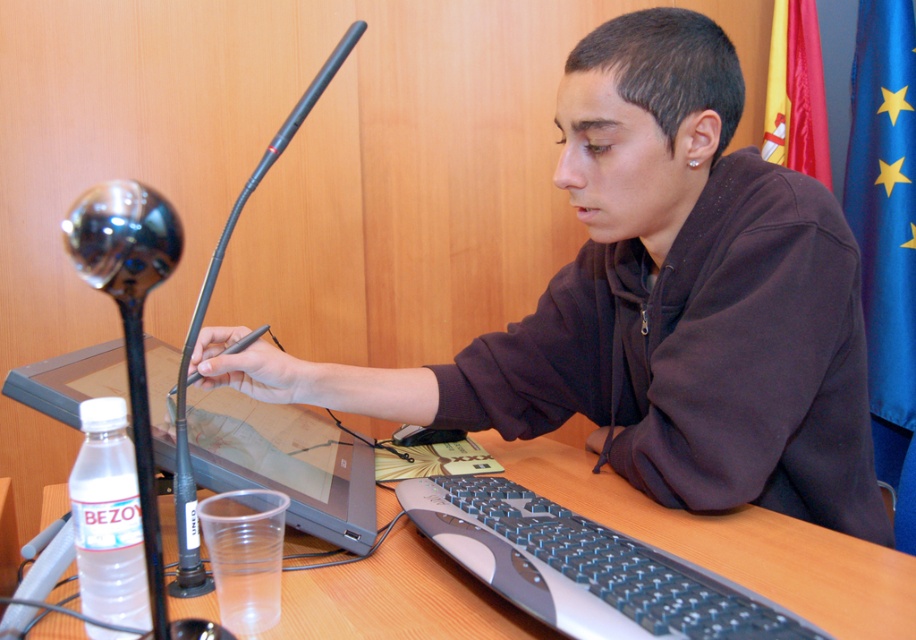
You are setting up for a video call and need to place your matte black laptop at left closer to the edge of the desk to ensure better visibility. Based on its current position at point 0.723, 0.312, is it positioned far enough from the edge to allow for adjustment without falling off?

The matte black laptop at left is located at point (285,461). Since the coordinates are relative to the desk, and assuming the edge is at 1.0, it is positioned 0.277 units away from the edge. This distance should be sufficient to adjust its position without risking it falling off.

You are organizing a small conference and need to place a 12 inch wide laptop stand on the desk. The stand must be placed between the matte black laptop at center and the wooden table at center. Is there enough space for the stand?

The matte black laptop at center is bigger than the wooden table at center. This statement seems contradictory because the laptop is placed on the table. Perhaps there was an error in the description. Assuming the laptop is larger than the table, which isn